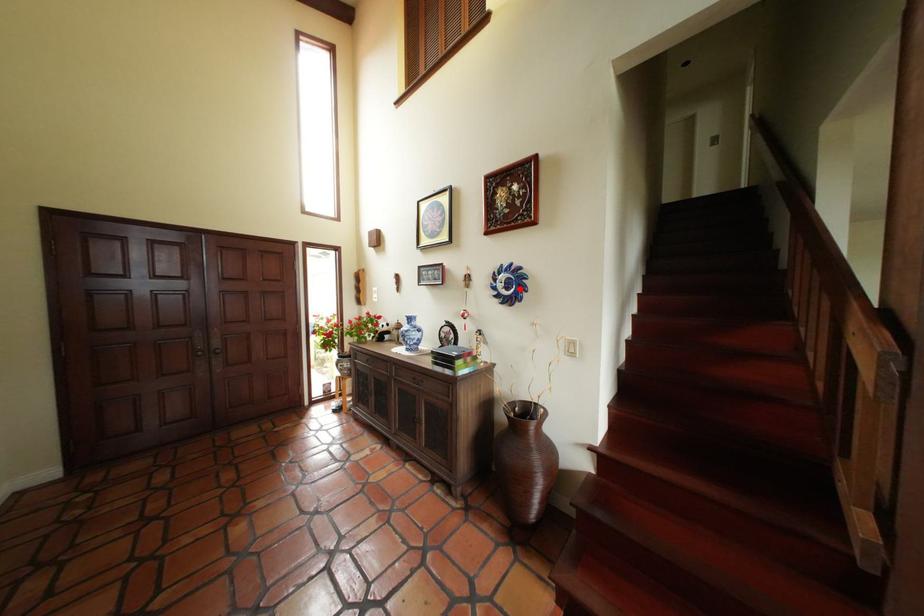
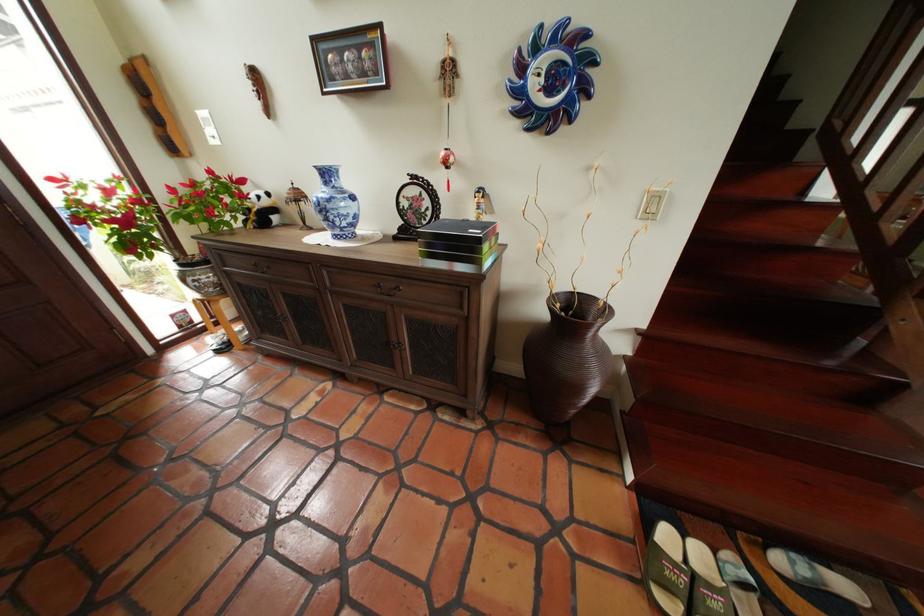
Where in the second image is the point corresponding to the highlighted location from the first image?

(563, 91)